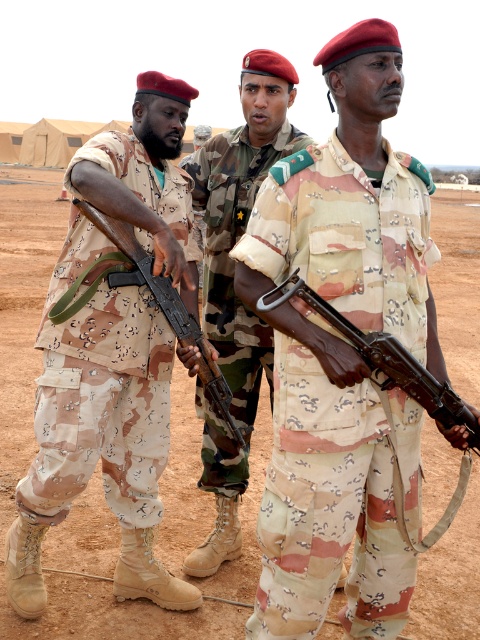
Question: Considering the real-world distances, which object is farthest from the camouflage fabric uniform at center?

Choices:
 (A) matte brown rifle at center
 (B) camouflage fabric rifle at center
 (C) camouflage fabric pants at left

Answer: (A)

Question: Among these objects, which one is nearest to the camera?

Choices:
 (A) wooden rifle at center
 (B) camouflage fabric pants at left
 (C) dirt field at center
 (D) camouflage fabric rifle at center

Answer: (D)

Question: Is camouflage fabric rifle at center closer to camera compared to wooden rifle at center?

Choices:
 (A) yes
 (B) no

Answer: (A)

Question: Which point appears closest to the camera in this image?

Choices:
 (A) (288, 138)
 (B) (370, 252)
 (C) (415, 358)
 (D) (36, 234)

Answer: (C)

Question: Does camouflage fabric pants at left have a smaller size compared to matte brown rifle at center?

Choices:
 (A) no
 (B) yes

Answer: (A)

Question: Is camouflage fabric rifle at center thinner than wooden rifle at center?

Choices:
 (A) yes
 (B) no

Answer: (B)